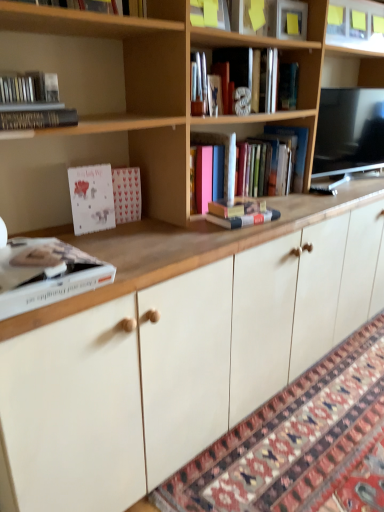
What are the coordinates of `empty space that is in between wooden bookcase at upper center and hardcover book at center, the 5th book positioned from the left` in the screenshot? It's located at (283, 212).